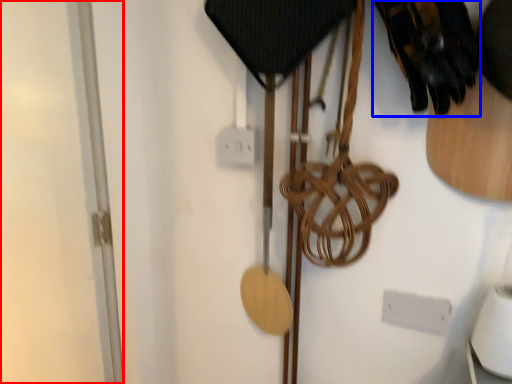
Question: Which of the following is the closest to the observer, glass door (highlighted by a red box) or footwear (highlighted by a blue box)?

Choices:
 (A) glass door
 (B) footwear

Answer: (B)